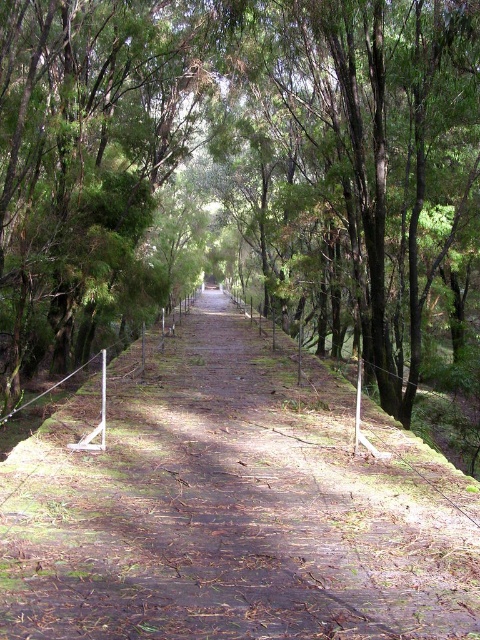
The image size is (480, 640). Describe the element at coordinates (236, 168) in the screenshot. I see `green leafy tree at center` at that location.

Does green leafy tree at center have a greater width compared to dirt path at center?

Correct, the width of green leafy tree at center exceeds that of dirt path at center.

Which is behind, point (193, 42) or point (21, 556)?

The point (193, 42) is behind.

Locate an element on the screen. green leafy tree at center is located at coordinates (236, 168).